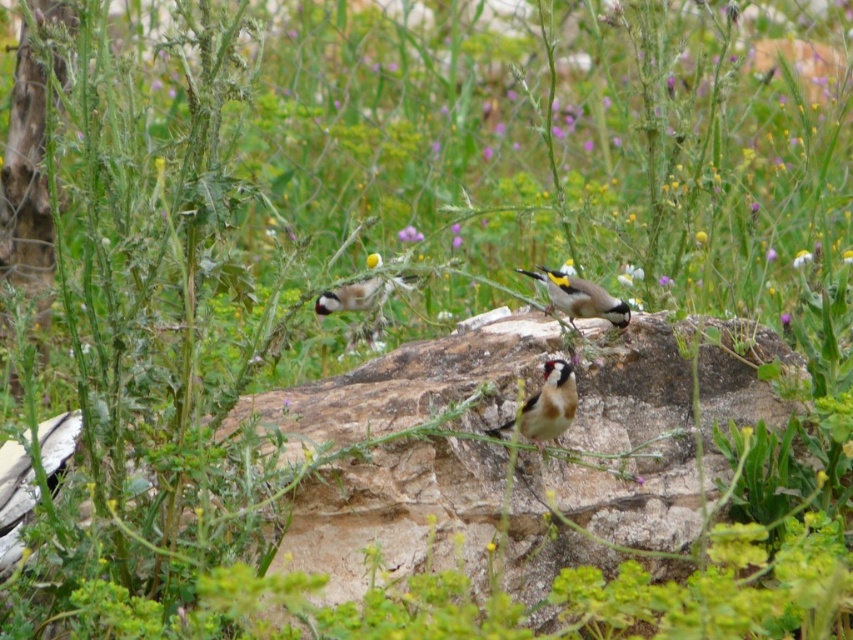
Is yellow and white speckled bird at center above yellow-green petal at center?

No.

Does point (552, 280) come farther from viewer compared to point (799, 268)?

That is False.

Where is `yellow and white speckled bird at center`? yellow and white speckled bird at center is located at coordinates (579, 298).

Which is behind, point (412, 234) or point (846, 257)?

Point (412, 234)

Is purple matte flower at center thinner than yellow-green leaf at center?

Indeed, purple matte flower at center has a lesser width compared to yellow-green leaf at center.

The image size is (853, 640). Describe the element at coordinates (409, 234) in the screenshot. I see `purple matte flower at center` at that location.

Locate an element on the screen. This screenshot has height=640, width=853. purple matte flower at center is located at coordinates (409, 234).

Who is more forward, [399,228] or [796,268]?

Point [796,268] is in front.

Between purple matte flower at center and yellow-green petal at center, which one appears on the right side from the viewer's perspective?

Positioned to the right is yellow-green petal at center.

The width and height of the screenshot is (853, 640). What do you see at coordinates (409, 234) in the screenshot?
I see `purple matte flower at center` at bounding box center [409, 234].

Where is `purple matte flower at center`? This screenshot has width=853, height=640. purple matte flower at center is located at coordinates (409, 234).